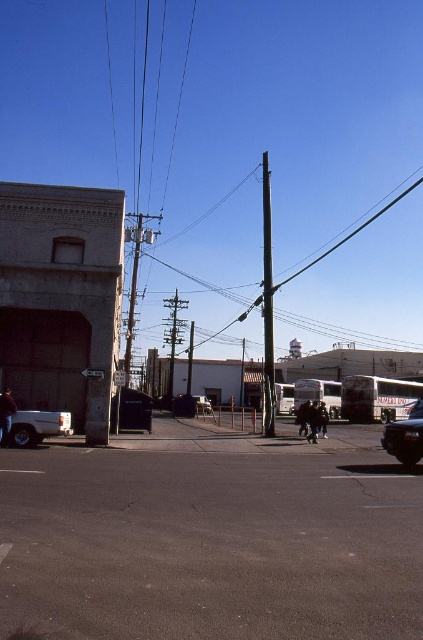
Who is positioned more to the left, dark asphalt parking lot at lower left or metallic gray telegraph pole at center?

From the viewer's perspective, metallic gray telegraph pole at center appears more on the left side.

Can you confirm if dark asphalt parking lot at lower left is positioned below metallic gray telegraph pole at center?

Actually, dark asphalt parking lot at lower left is above metallic gray telegraph pole at center.

Is point (43, 600) behind point (180, 340)?

No.

Where is `dark asphalt parking lot at lower left`? This screenshot has width=423, height=640. dark asphalt parking lot at lower left is located at coordinates (211, 540).

Can you confirm if dark asphalt parking lot at lower left is smaller than shiny black sedan at lower right?

No.

Does dark asphalt parking lot at lower left have a greater height compared to shiny black sedan at lower right?

Correct, dark asphalt parking lot at lower left is much taller as shiny black sedan at lower right.

The width and height of the screenshot is (423, 640). Describe the element at coordinates (211, 540) in the screenshot. I see `dark asphalt parking lot at lower left` at that location.

The height and width of the screenshot is (640, 423). Find the location of `dark asphalt parking lot at lower left`. dark asphalt parking lot at lower left is located at coordinates (211, 540).

Can you confirm if smooth black pole at center is positioned above metallic gray telegraph pole at center?

Correct, smooth black pole at center is located above metallic gray telegraph pole at center.

Which is behind, point (272, 324) or point (181, 298)?

The point (181, 298) is behind.

Is point (269, 435) positioned before point (169, 337)?

That is True.

I want to click on smooth black pole at center, so click(268, 304).